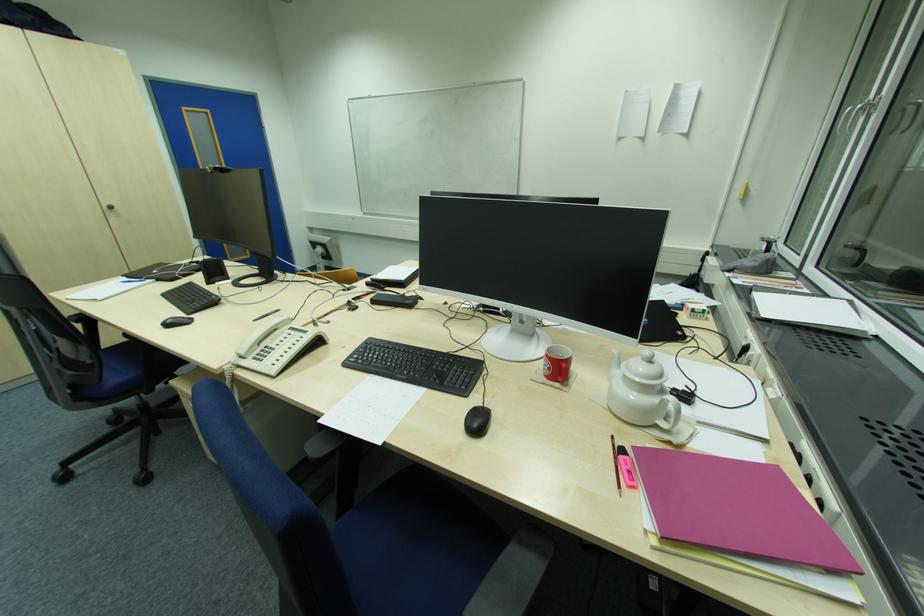
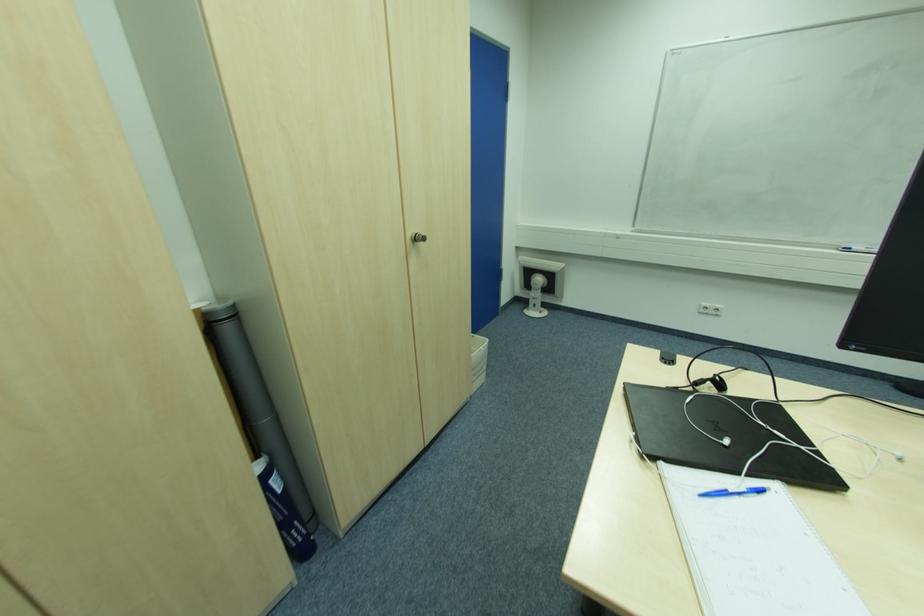
Find the pixel in the second image that matches point (136, 283) in the first image.

(727, 493)